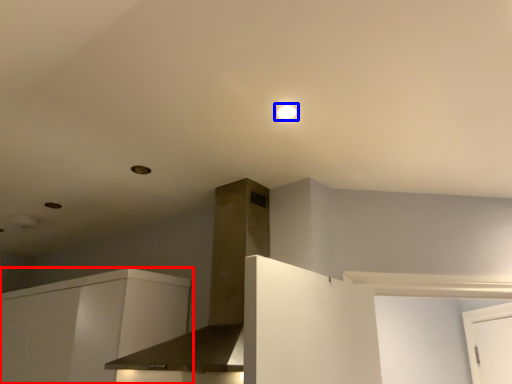
Question: Which of the following is the farthest to the observer, cabinetry (highlighted by a red box) or lighting (highlighted by a blue box)?

Choices:
 (A) cabinetry
 (B) lighting

Answer: (A)